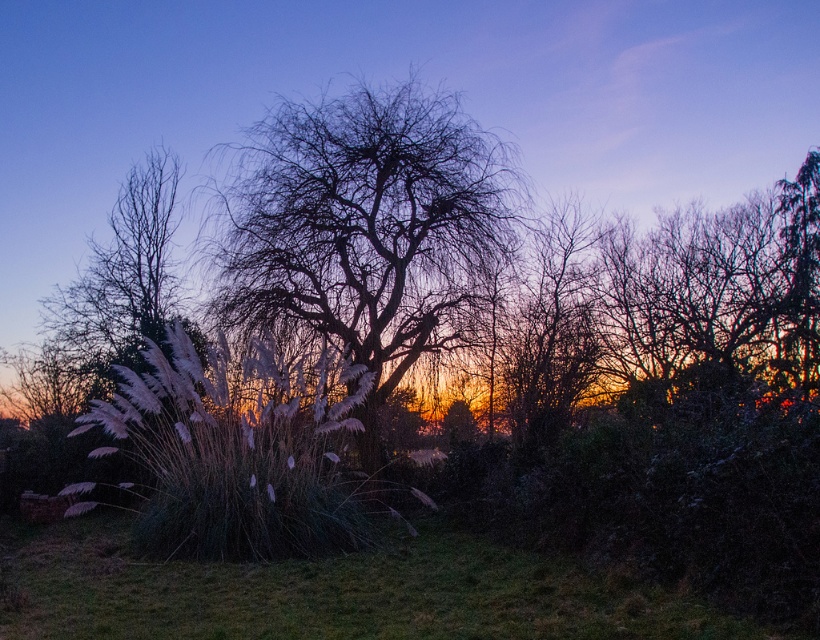
Is green grass at lower center shorter than white fluffy grass at left?

Yes.

Is point (680, 628) in front of point (148, 161)?

Yes, point (680, 628) is closer to viewer.

You are a GUI agent. You are given a task and a screenshot of the screen. Output one action in this format:
    pyautogui.click(x=<x>, y=<y>)
    Task: Click on the green grass at lower center
    Image resolution: width=820 pixels, height=640 pixels.
    Given the screenshot: What is the action you would take?
    pyautogui.click(x=329, y=592)

Is bare branches at center positioned before white fluffy grass at left?

Yes, bare branches at center is closer to the viewer.

What do you see at coordinates (365, 228) in the screenshot? I see `bare branches at center` at bounding box center [365, 228].

Locate an element on the screen. bare branches at center is located at coordinates (365, 228).

How far apart are bare branches at center and green grass at lower center?

They are 6.12 meters apart.

Which of these two, bare branches at center or green grass at lower center, stands taller?

bare branches at center is taller.

Does point (422, 180) come in front of point (531, 605)?

No, it is not.

The height and width of the screenshot is (640, 820). What are the coordinates of `bare branches at center` in the screenshot? It's located at (365, 228).